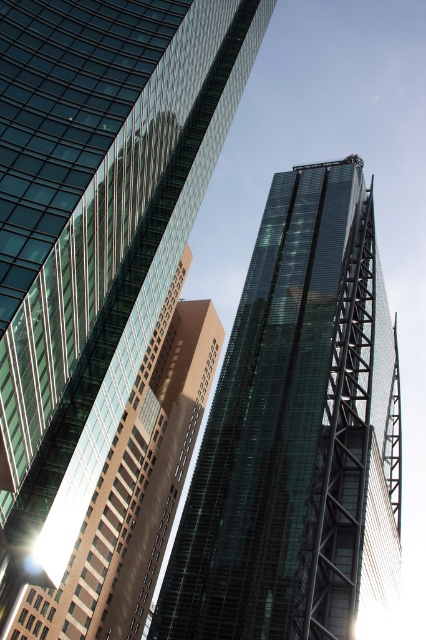
You are an architect analyzing the image of two skyscrapers. You need to determine which of the two buildings, the transparent glass skyscraper at center or the green glass tower at center, has a greater height. Based on the provided information, which one is taller?

The transparent glass skyscraper at center is much taller than the green glass tower at center, so the transparent glass skyscraper at center is the taller one.

You are standing in front of the skyscrapers and want to determine which of the two points, point (78, 240) or point (278, 592), is nearer to you. Based on the image, which one is closer?

Point (78, 240) is closer to the viewer than point (278, 592).